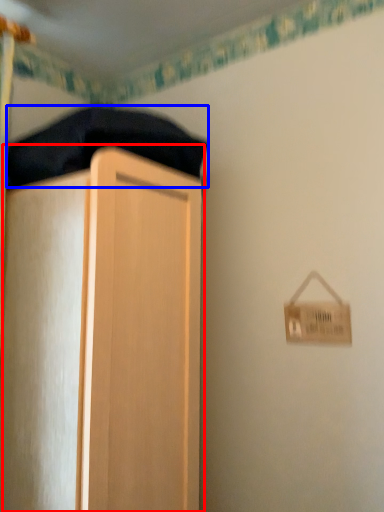
Question: Which of the following is the farthest to the observer, cupboard (highlighted by a red box) or bedding (highlighted by a blue box)?

Choices:
 (A) cupboard
 (B) bedding

Answer: (B)